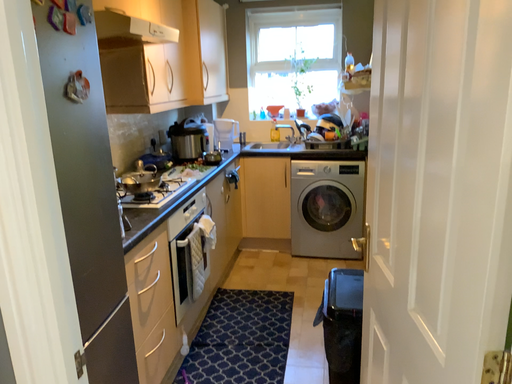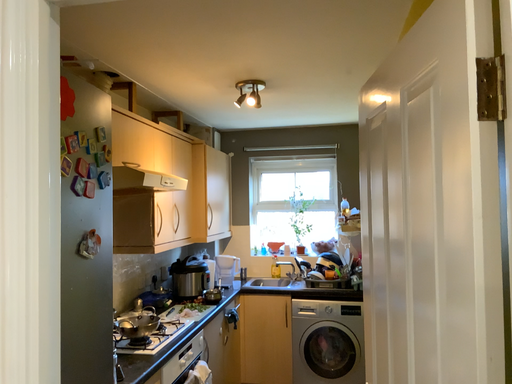
Question: How did the camera likely rotate when shooting the video?

Choices:
 (A) rotated downward
 (B) rotated upward

Answer: (B)